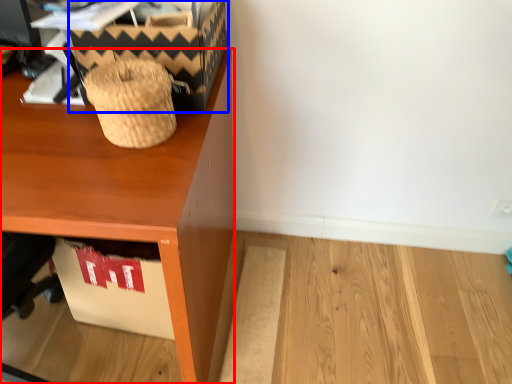
Question: Which point is closer to the camera, desk (highlighted by a red box) or shoe box (highlighted by a blue box)?

Choices:
 (A) desk
 (B) shoe box

Answer: (A)